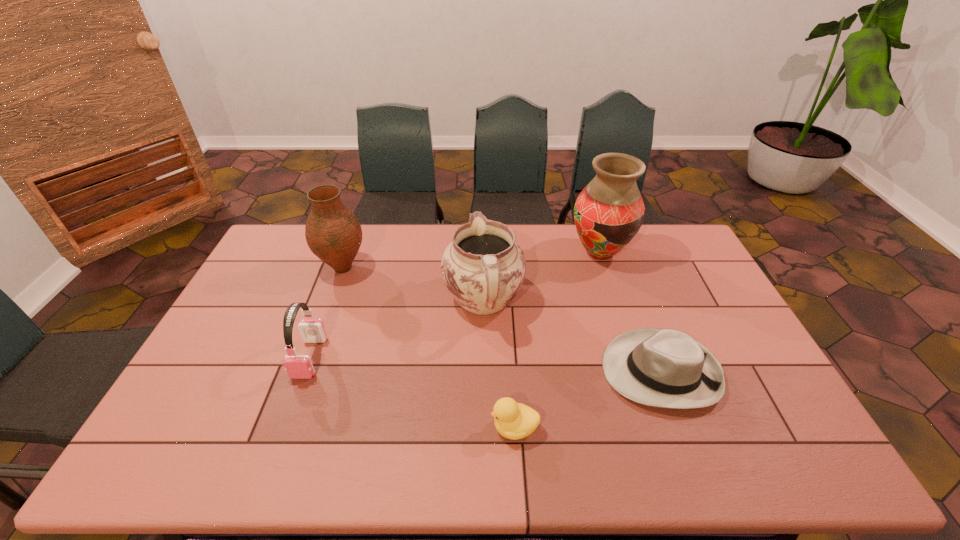
Locate an element on the screen. Image resolution: width=960 pixels, height=540 pixels. vacant space that's between the earphone and the duck is located at coordinates (412, 393).

You are a GUI agent. You are given a task and a screenshot of the screen. Output one action in this format:
    pyautogui.click(x=<x>, y=<y>)
    Task: Click on the blank region between the right vase and the fedora
    Image resolution: width=960 pixels, height=540 pixels.
    Given the screenshot: What is the action you would take?
    pyautogui.click(x=630, y=312)

Where is `free spot between the duck and the shorter vase`? This screenshot has width=960, height=540. free spot between the duck and the shorter vase is located at coordinates (429, 348).

This screenshot has width=960, height=540. In order to click on empty location between the pitcher and the duck in this screenshot , I will do `click(499, 364)`.

Select which object appears as the fifth closest to the pitcher. Please provide its 2D coordinates. Your answer should be formatted as a tuple, i.e. [(x, y)], where the tuple contains the x and y coordinates of a point satisfying the conditions above.

[(297, 366)]

Where is `object that ranks as the closest to the earphone`? This screenshot has height=540, width=960. object that ranks as the closest to the earphone is located at coordinates (333, 233).